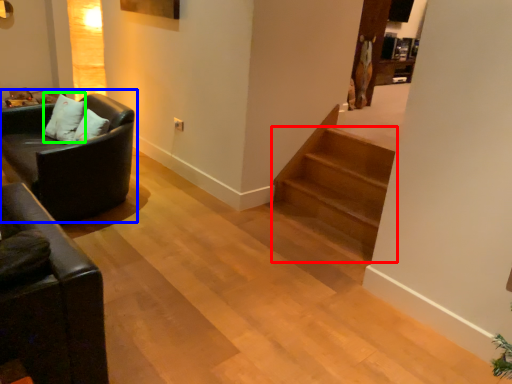
Question: Which object is positioned farthest from stairs (highlighted by a red box)? Select from studio couch (highlighted by a blue box) and pillow (highlighted by a green box).

Choices:
 (A) studio couch
 (B) pillow

Answer: (B)